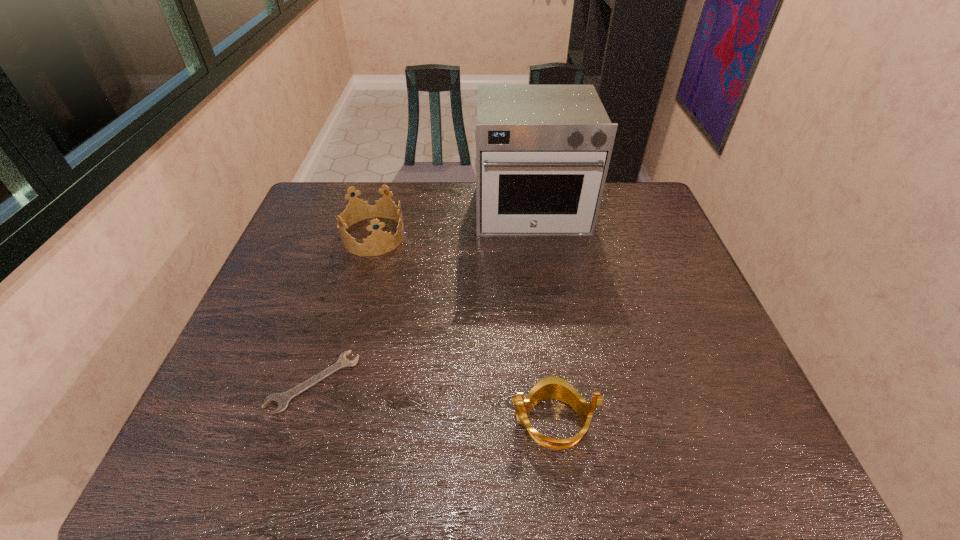
The height and width of the screenshot is (540, 960). Find the location of `free point between the tallest object and the third tallest object`. free point between the tallest object and the third tallest object is located at coordinates (541, 316).

This screenshot has width=960, height=540. I want to click on vacant area between the wrench and the shorter tiara, so click(433, 402).

You are a GUI agent. You are given a task and a screenshot of the screen. Output one action in this format:
    pyautogui.click(x=<x>, y=<y>)
    Task: Click on the vacant space that is in between the toaster oven and the shorter tiara
    The height and width of the screenshot is (540, 960).
    Given the screenshot: What is the action you would take?
    pos(541,316)

This screenshot has width=960, height=540. What are the coordinates of `vacant area that lies between the shortest object and the left tiara` in the screenshot? It's located at (344, 309).

The width and height of the screenshot is (960, 540). Find the location of `vacant space in between the third tallest object and the toaster oven`. vacant space in between the third tallest object and the toaster oven is located at coordinates (541, 316).

This screenshot has width=960, height=540. I want to click on object that can be found as the third closest to the third shortest object, so click(556, 388).

Locate an element on the screen. The image size is (960, 540). object that is the nearest to the nearer tiara is located at coordinates (282, 399).

Find the location of a particular element. vacant area that satisfies the following two spatial constraints: 1. on the front panel of the tallest object; 2. on the front-facing side of the taller tiara is located at coordinates (535, 236).

The height and width of the screenshot is (540, 960). I want to click on free region that satisfies the following two spatial constraints: 1. on the front panel of the toaster oven; 2. on the front-facing side of the taller tiara, so pyautogui.click(x=535, y=236).

The image size is (960, 540). Identify the location of free space that satisfies the following two spatial constraints: 1. on the front panel of the tallest object; 2. on the front-facing side of the left tiara. (535, 236).